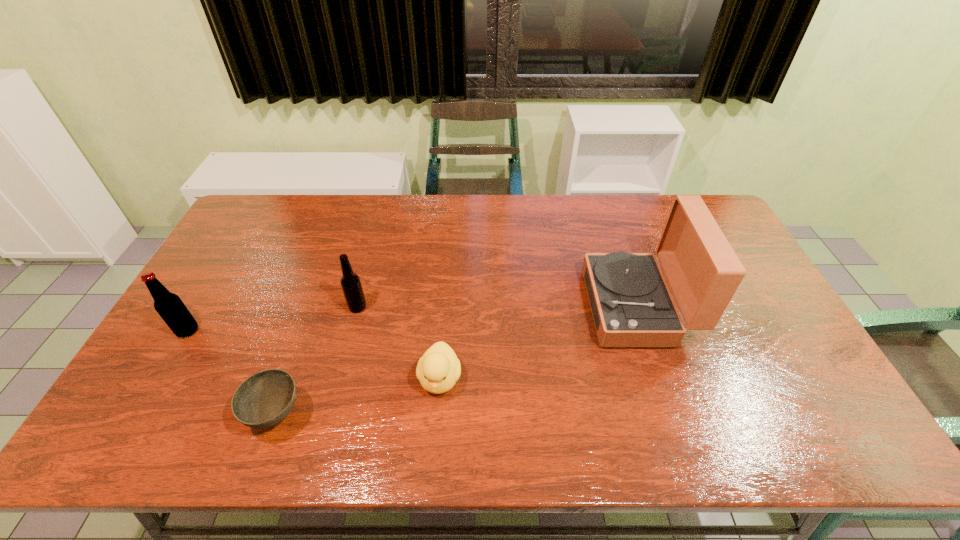
In order to click on vacant space located on the face of the rightmost object in this screenshot , I will do `click(562, 307)`.

At what (x,y) coordinates should I click in order to perform the action: click on vacant region located on the face of the rightmost object. Please return your answer as a coordinate pair (x, y). This screenshot has height=540, width=960. Looking at the image, I should click on (535, 307).

The image size is (960, 540). Identify the location of vacant space located on the face of the rightmost object. (456, 307).

You are a GUI agent. You are given a task and a screenshot of the screen. Output one action in this format:
    pyautogui.click(x=<x>, y=<y>)
    Task: Click on the vacant space located 0.060m on the front of the left beer bottle
    This screenshot has height=540, width=960.
    Given the screenshot: What is the action you would take?
    pyautogui.click(x=172, y=358)

At what (x,y) coordinates should I click in order to perform the action: click on vacant space located 0.400m on the front of the farther beer bottle. Please return your answer as a coordinate pair (x, y). This screenshot has height=540, width=960. Looking at the image, I should click on (321, 450).

In order to click on vacant space located 0.110m on the front-facing side of the fourth object from left to right in this screenshot , I will do `click(435, 447)`.

This screenshot has height=540, width=960. Find the location of `free region located on the left of the shortest object`. free region located on the left of the shortest object is located at coordinates (194, 415).

Locate an element on the screen. The height and width of the screenshot is (540, 960). object present at the near edge is located at coordinates (266, 398).

I want to click on object situated at the left edge, so click(x=169, y=306).

Find the location of a particular element. This screenshot has width=960, height=540. free space at the far edge is located at coordinates (464, 204).